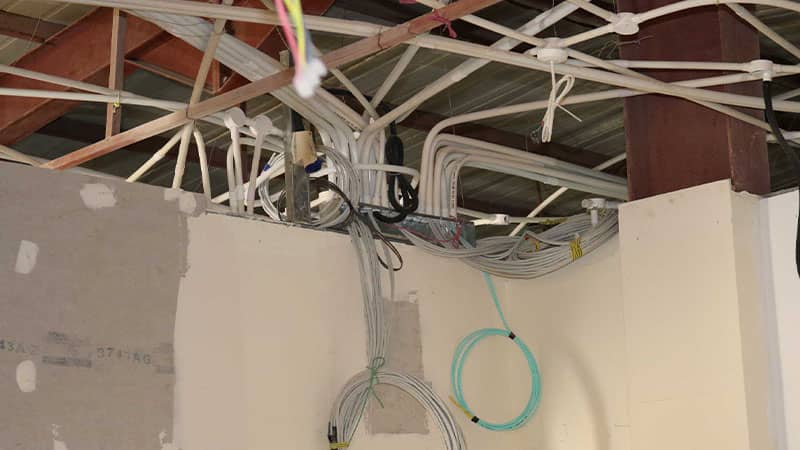
The height and width of the screenshot is (450, 800). I want to click on white wall, so click(x=306, y=317).